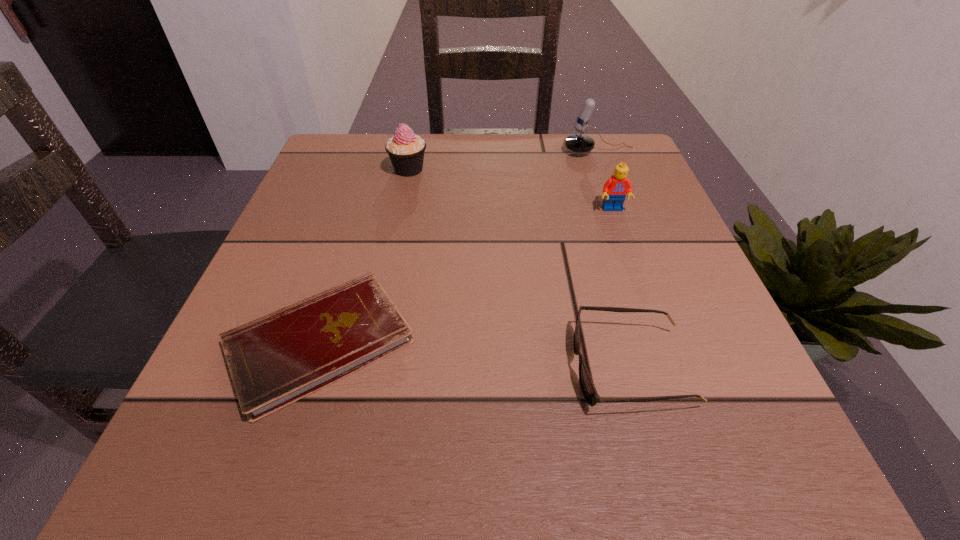
Where is `free space located 0.350m on the lenses of the fourth tallest object`? The image size is (960, 540). free space located 0.350m on the lenses of the fourth tallest object is located at coordinates (325, 368).

Locate an element on the screen. The image size is (960, 540). vacant space located on the back of the shortest object is located at coordinates (367, 195).

The height and width of the screenshot is (540, 960). What are the coordinates of `microphone at the far edge` in the screenshot? It's located at [x=579, y=143].

Image resolution: width=960 pixels, height=540 pixels. What are the coordinates of `cupcake that is at the far edge` in the screenshot? It's located at (406, 150).

You are a GUI agent. You are given a task and a screenshot of the screen. Output one action in this format:
    pyautogui.click(x=<x>, y=<y>)
    Task: Click on the object present at the near edge
    Image resolution: width=960 pixels, height=540 pixels.
    Given the screenshot: What is the action you would take?
    pyautogui.click(x=275, y=360)

This screenshot has width=960, height=540. I want to click on object that is at the left edge, so click(275, 360).

You are a GUI agent. You are given a task and a screenshot of the screen. Output one action in this format:
    pyautogui.click(x=<x>, y=<y>)
    Task: Click on the microphone that is at the right edge
    This screenshot has height=540, width=960.
    Given the screenshot: What is the action you would take?
    pyautogui.click(x=579, y=143)

The image size is (960, 540). What are the coordinates of `Lego that is at the right edge` in the screenshot? It's located at (615, 189).

Locate an element on the screen. This screenshot has height=540, width=960. sunglasses that is at the right edge is located at coordinates (590, 394).

Where is `object at the near left corner`? The height and width of the screenshot is (540, 960). object at the near left corner is located at coordinates (275, 360).